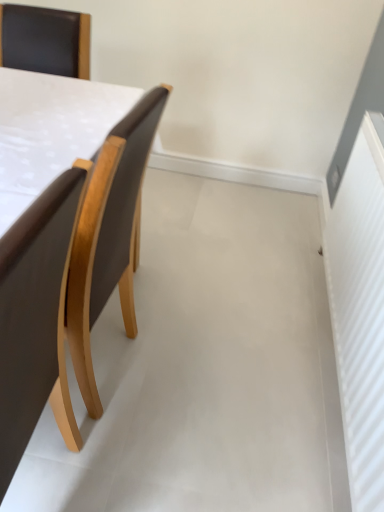
Find the location of a particular element. This screenshot has width=384, height=512. brown leather chair at left, marked as the 2th chair in a front-to-back arrangement is located at coordinates (108, 236).

The image size is (384, 512). Describe the element at coordinates (108, 236) in the screenshot. I see `brown leather chair at left, which ranks as the first chair in back-to-front order` at that location.

The width and height of the screenshot is (384, 512). I want to click on brown leather chair at left, which ranks as the 1th chair in front-to-back order, so click(x=36, y=319).

The width and height of the screenshot is (384, 512). What do you see at coordinates (36, 319) in the screenshot?
I see `brown leather chair at left, which ranks as the 1th chair in front-to-back order` at bounding box center [36, 319].

You are a GUI agent. You are given a task and a screenshot of the screen. Output one action in this format:
    pyautogui.click(x=<x>, y=<y>)
    Task: Click on the brown leather chair at left, marked as the 2th chair in a front-to-back arrangement
    The image size is (384, 512).
    Given the screenshot: What is the action you would take?
    pyautogui.click(x=108, y=236)

Considering the positions of objects brown leather chair at left, which ranks as the first chair in back-to-front order, and brown leather chair at left, the 2th chair from the back, in the image provided, who is more to the right, brown leather chair at left, which ranks as the first chair in back-to-front order, or brown leather chair at left, the 2th chair from the back,?

brown leather chair at left, which ranks as the first chair in back-to-front order.

Which object is closer to the camera, brown leather chair at left, which ranks as the first chair in back-to-front order, or brown leather chair at left, the 2th chair from the back?

brown leather chair at left, the 2th chair from the back, is more forward.

Based on the photo, which is closer to the camera, (67, 422) or (13, 465)?

Clearly, point (67, 422) is more distant from the camera than point (13, 465).

From the image's perspective, is brown leather chair at left, which ranks as the first chair in back-to-front order, located above brown leather chair at left, the 2th chair from the back?

Correct, brown leather chair at left, which ranks as the first chair in back-to-front order, appears higher than brown leather chair at left, the 2th chair from the back, in the image.

From a real-world perspective, which is physically below, brown leather chair at left, marked as the 2th chair in a front-to-back arrangement, or brown leather chair at left, which ranks as the 1th chair in front-to-back order?

From a 3D spatial view, brown leather chair at left, marked as the 2th chair in a front-to-back arrangement, is below.

Which of these two, brown leather chair at left, marked as the 2th chair in a front-to-back arrangement, or brown leather chair at left, which ranks as the 1th chair in front-to-back order, is thinner?

brown leather chair at left, which ranks as the 1th chair in front-to-back order, is thinner.

Who is shorter, brown leather chair at left, which ranks as the first chair in back-to-front order, or brown leather chair at left, the 2th chair from the back?

brown leather chair at left, which ranks as the first chair in back-to-front order, is shorter.

Does brown leather chair at left, which ranks as the first chair in back-to-front order, have a smaller size compared to brown leather chair at left, the 2th chair from the back?

No, brown leather chair at left, which ranks as the first chair in back-to-front order, is not smaller than brown leather chair at left, the 2th chair from the back.

Based on the photo, choose the correct answer: Is brown leather chair at left, marked as the 2th chair in a front-to-back arrangement, inside brown leather chair at left, the 2th chair from the back, or outside it?

brown leather chair at left, marked as the 2th chair in a front-to-back arrangement, is spatially situated outside brown leather chair at left, the 2th chair from the back.

Is brown leather chair at left, marked as the 2th chair in a front-to-back arrangement, not close to brown leather chair at left, the 2th chair from the back?

That's not correct — brown leather chair at left, marked as the 2th chair in a front-to-back arrangement, is a little close to brown leather chair at left, the 2th chair from the back.

Could you tell me if brown leather chair at left, which ranks as the first chair in back-to-front order, is turned towards brown leather chair at left, the 2th chair from the back?

No, brown leather chair at left, which ranks as the first chair in back-to-front order, is not turned towards brown leather chair at left, the 2th chair from the back.

Identify the location of chair that appears on the right of brown leather chair at left, the 2th chair from the back. click(x=108, y=236).

Between brown leather chair at left, the 2th chair from the back, and brown leather chair at left, marked as the 2th chair in a front-to-back arrangement, which one appears on the left side from the viewer's perspective?

brown leather chair at left, the 2th chair from the back.

Considering their positions, is brown leather chair at left, which ranks as the 1th chair in front-to-back order, located in front of or behind brown leather chair at left, marked as the 2th chair in a front-to-back arrangement?

In the image, brown leather chair at left, which ranks as the 1th chair in front-to-back order, appears in front of brown leather chair at left, marked as the 2th chair in a front-to-back arrangement.

Is point (66, 401) closer to camera compared to point (52, 407)?

No.

From the image's perspective, would you say brown leather chair at left, which ranks as the 1th chair in front-to-back order, is positioned over brown leather chair at left, which ranks as the first chair in back-to-front order?

No, from the image's perspective, brown leather chair at left, which ranks as the 1th chair in front-to-back order, is not over brown leather chair at left, which ranks as the first chair in back-to-front order.

From a real-world perspective, which object stands above the other?

brown leather chair at left, the 2th chair from the back, is physically above.

Between brown leather chair at left, the 2th chair from the back, and brown leather chair at left, which ranks as the first chair in back-to-front order, which one has larger width?

brown leather chair at left, which ranks as the first chair in back-to-front order.

Which of these two, brown leather chair at left, which ranks as the 1th chair in front-to-back order, or brown leather chair at left, marked as the 2th chair in a front-to-back arrangement, stands shorter?

brown leather chair at left, marked as the 2th chair in a front-to-back arrangement.

Does brown leather chair at left, which ranks as the 1th chair in front-to-back order, have a smaller size compared to brown leather chair at left, marked as the 2th chair in a front-to-back arrangement?

Result: Yes, brown leather chair at left, which ranks as the 1th chair in front-to-back order, is smaller than brown leather chair at left, marked as the 2th chair in a front-to-back arrangement.

Consider the image. Is brown leather chair at left, marked as the 2th chair in a front-to-back arrangement, located within brown leather chair at left, which ranks as the 1th chair in front-to-back order?

Definitely not — brown leather chair at left, marked as the 2th chair in a front-to-back arrangement, is not inside brown leather chair at left, which ranks as the 1th chair in front-to-back order.

Consider the image. Is the surface of brown leather chair at left, which ranks as the 1th chair in front-to-back order, in direct contact with brown leather chair at left, which ranks as the first chair in back-to-front order?

No, brown leather chair at left, which ranks as the 1th chair in front-to-back order, is not making contact with brown leather chair at left, which ranks as the first chair in back-to-front order.

Is brown leather chair at left, which ranks as the 1th chair in front-to-back order, aimed at brown leather chair at left, which ranks as the first chair in back-to-front order?

No.

In the image, there is a brown leather chair at left, marked as the 2th chair in a front-to-back arrangement. Identify the location of chair below it (from the image's perspective). (36, 319).

I want to click on chair that is in front of the brown leather chair at left, marked as the 2th chair in a front-to-back arrangement, so click(36, 319).

At what (x,y) coordinates should I click in order to perform the action: click on chair located below the brown leather chair at left, which ranks as the first chair in back-to-front order (from the image's perspective). Please return your answer as a coordinate pair (x, y). The width and height of the screenshot is (384, 512). Looking at the image, I should click on (36, 319).